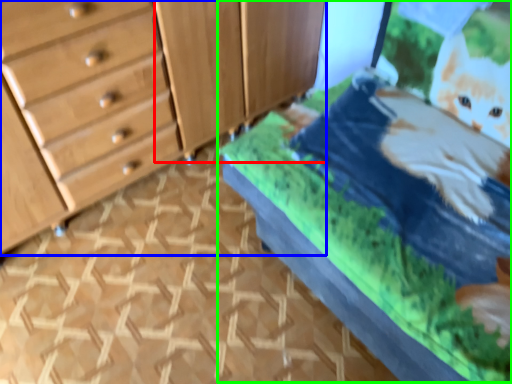
Question: Which is nearer to the cabinetry (highlighted by a red box)? chest of drawers (highlighted by a blue box) or bed (highlighted by a green box).

Choices:
 (A) chest of drawers
 (B) bed

Answer: (A)